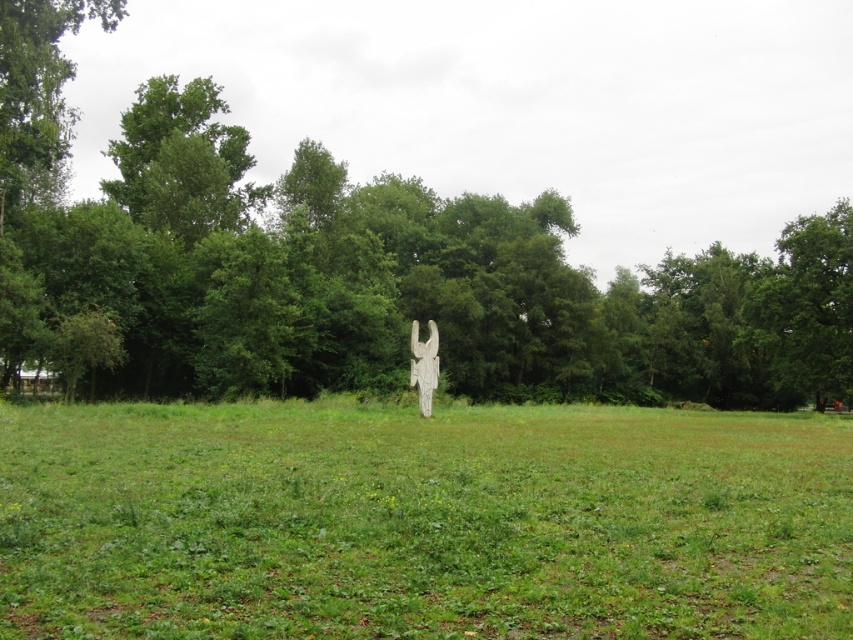
Question: Which object is positioned farthest from the green grass at center?

Choices:
 (A) white stone statue at center
 (B) green leafy tree at center

Answer: (B)

Question: Does green leafy tree at center have a lesser width compared to white stone statue at center?

Choices:
 (A) yes
 (B) no

Answer: (B)

Question: Is green grass at center smaller than green leafy tree at center?

Choices:
 (A) no
 (B) yes

Answer: (B)

Question: Based on their relative distances, which object is nearer to the white stone statue at center?

Choices:
 (A) green grass at center
 (B) green leafy tree at center

Answer: (A)

Question: Which object is positioned closest to the white stone statue at center?

Choices:
 (A) green leafy tree at center
 (B) green grass at center

Answer: (B)

Question: Is green grass at center behind white stone statue at center?

Choices:
 (A) no
 (B) yes

Answer: (A)